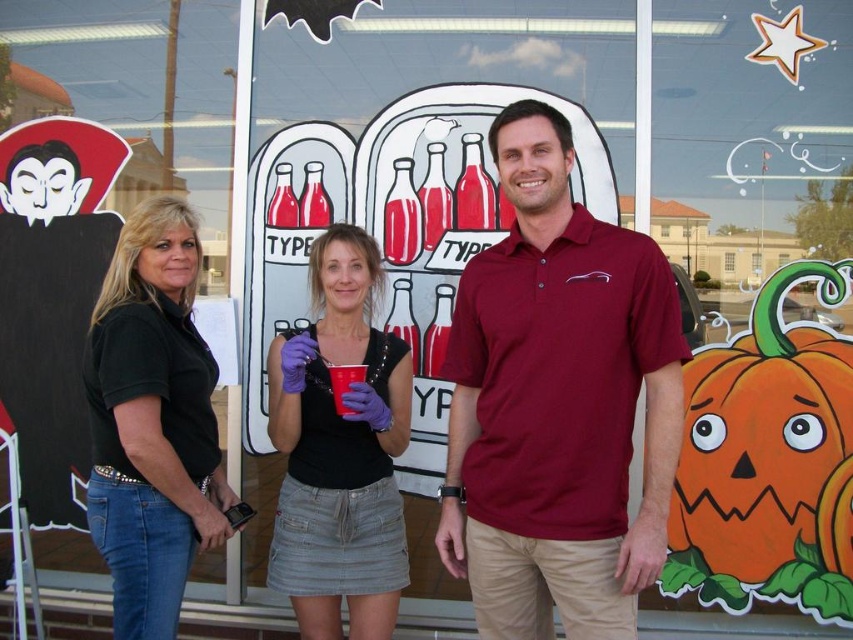
What do you see at coordinates (152, 420) in the screenshot? I see `black denim jeans at left` at bounding box center [152, 420].

The width and height of the screenshot is (853, 640). What are the coordinates of `black denim jeans at left` in the screenshot? It's located at (152, 420).

Between maroon polo shirt at center and black denim jeans at left, which one appears on the right side from the viewer's perspective?

maroon polo shirt at center is more to the right.

Between maroon polo shirt at center and black denim jeans at left, which one is positioned higher?

maroon polo shirt at center is higher up.

Image resolution: width=853 pixels, height=640 pixels. What are the coordinates of `maroon polo shirt at center` in the screenshot? It's located at (556, 403).

The height and width of the screenshot is (640, 853). Identify the location of maroon polo shirt at center. (556, 403).

Is maroon polo shirt at center above black denim skirt at center?

Yes.

Can you confirm if maroon polo shirt at center is shorter than black denim skirt at center?

In fact, maroon polo shirt at center may be taller than black denim skirt at center.

This screenshot has height=640, width=853. Find the location of `maroon polo shirt at center`. maroon polo shirt at center is located at coordinates (556, 403).